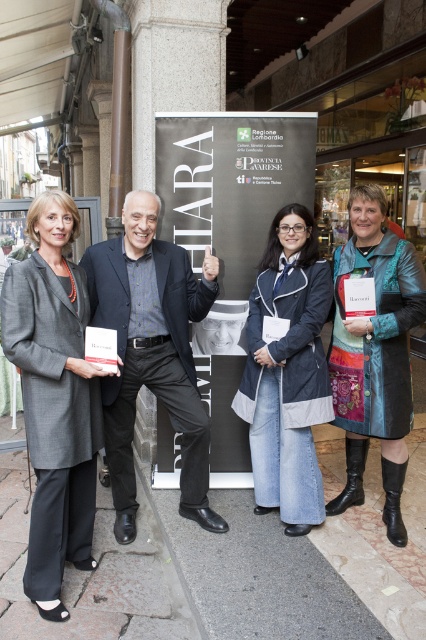
You are a photographer who needs to ensure all subjects are visible in a group photo. The two central subjects are wearing a dark gray suit at center and a leather jacket at center. Which of these two should you focus on to ensure both are in frame if one is slightly out of focus?

The dark gray suit at center is larger in size than the leather jacket at center, so focusing on the larger one might help keep both in the frame better due to depth of field considerations.

You are a photographer trying to capture a group photo of the dark gray suit at center and denim jacket at center. The minimum distance your camera can focus clearly is 20 inches. Will you be able to take a clear photo of both subjects at the same time?

The dark gray suit at center and denim jacket at center are 19.90 inches apart, which is less than the camera minimum focus distance of 20 inches. Therefore, the camera cannot focus clearly on both subjects simultaneously.

Where is the matte gray coat at center located in the image?

The matte gray coat at center is located at point 0.622 on the x axis and 0.129 on the y axis.